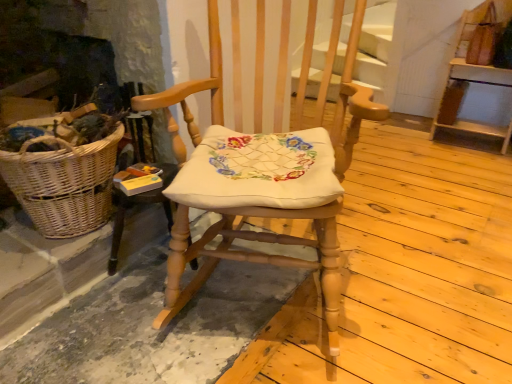
Question: Is wooden rocking chair at center inside the boundaries of woven wicker picnic basket at left, or outside?

Choices:
 (A) outside
 (B) inside

Answer: (A)

Question: From a real-world perspective, relative to woven wicker picnic basket at left, is wooden rocking chair at center vertically above or below?

Choices:
 (A) below
 (B) above

Answer: (B)

Question: Based on their relative distances, which object is farther from the wooden rocking chair at center?

Choices:
 (A) woven wicker picnic basket at left
 (B) wooden shelf at upper right

Answer: (B)

Question: Which object is positioned farthest from the wooden rocking chair at center?

Choices:
 (A) woven wicker picnic basket at left
 (B) wooden shelf at upper right

Answer: (B)